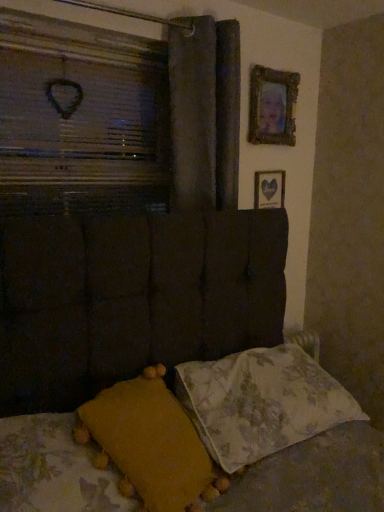
Question: Can you confirm if wooden picture frame at upper right, which is the first picture frame from bottom to top, is shorter than dark fabric curtain at upper center?

Choices:
 (A) no
 (B) yes

Answer: (B)

Question: Can you confirm if wooden picture frame at upper right, which is the first picture frame from bottom to top, is positioned to the right of dark fabric curtain at upper center?

Choices:
 (A) no
 (B) yes

Answer: (B)

Question: From the image's perspective, is wooden picture frame at upper right, placed as the 2th picture frame when sorted from top to bottom, located beneath dark fabric curtain at upper center?

Choices:
 (A) no
 (B) yes

Answer: (B)

Question: Is wooden picture frame at upper right, which is the first picture frame from bottom to top, turned away from dark fabric curtain at upper center?

Choices:
 (A) no
 (B) yes

Answer: (A)

Question: Is wooden picture frame at upper right, which is the first picture frame from bottom to top, not close to dark fabric curtain at upper center?

Choices:
 (A) yes
 (B) no

Answer: (B)

Question: Is gold-framed picture at upper right, which ranks as the second picture frame in bottom-to-top order, taller or shorter than wooden heart at upper left?

Choices:
 (A) short
 (B) tall

Answer: (A)

Question: Considering their positions, is gold-framed picture at upper right, which ranks as the second picture frame in bottom-to-top order, located in front of or behind wooden heart at upper left?

Choices:
 (A) behind
 (B) front

Answer: (A)

Question: From a real-world perspective, is gold-framed picture at upper right, which ranks as the second picture frame in bottom-to-top order, above or below wooden heart at upper left?

Choices:
 (A) above
 (B) below

Answer: (A)

Question: Does point (292, 139) appear closer or farther from the camera than point (114, 161)?

Choices:
 (A) closer
 (B) farther

Answer: (B)

Question: In terms of size, does dark fabric curtain at upper center appear bigger or smaller than gold-framed picture at upper right, which ranks as the second picture frame in bottom-to-top order?

Choices:
 (A) small
 (B) big

Answer: (B)

Question: Is point (183, 160) positioned closer to the camera than point (283, 84)?

Choices:
 (A) farther
 (B) closer

Answer: (B)

Question: From the image's perspective, relative to gold-framed picture at upper right, which ranks as the second picture frame in bottom-to-top order, is dark fabric curtain at upper center above or below?

Choices:
 (A) below
 (B) above

Answer: (A)

Question: Do you think dark fabric curtain at upper center is within gold-framed picture at upper right, the 1th picture frame in the top-to-bottom sequence, or outside of it?

Choices:
 (A) outside
 (B) inside

Answer: (A)

Question: Looking at their shapes, would you say floral fabric pillow at lower right, acting as the second pillow starting from the left, is wider or thinner than gold-framed picture at upper right, which ranks as the second picture frame in bottom-to-top order?

Choices:
 (A) thin
 (B) wide

Answer: (B)

Question: Is floral fabric pillow at lower right, which is the 1th pillow in right-to-left order, spatially inside gold-framed picture at upper right, which ranks as the second picture frame in bottom-to-top order, or outside of it?

Choices:
 (A) inside
 (B) outside

Answer: (B)